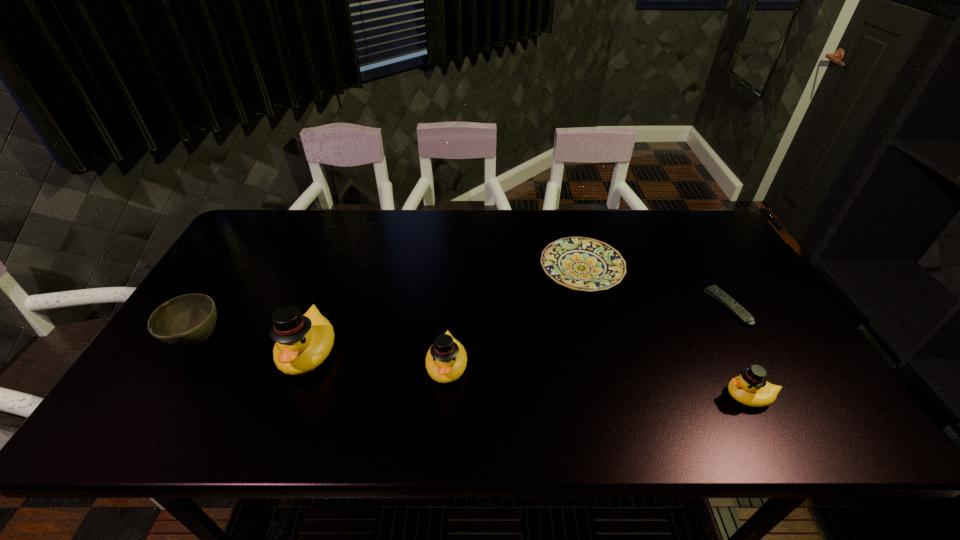
Locate an element on the screen. Image resolution: width=960 pixels, height=540 pixels. blank space at the far edge is located at coordinates (328, 229).

Image resolution: width=960 pixels, height=540 pixels. In the image, there is a desktop. Find the location of `vacant area at the near edge`. vacant area at the near edge is located at coordinates (540, 393).

You are a GUI agent. You are given a task and a screenshot of the screen. Output one action in this format:
    pyautogui.click(x=<x>, y=<y>)
    Task: Click on the free spot at the left edge of the desktop
    
    Given the screenshot: What is the action you would take?
    pyautogui.click(x=237, y=274)

This screenshot has width=960, height=540. In order to click on vacant space at the right edge of the desktop in this screenshot , I will do `click(772, 325)`.

In the image, there is a desktop. At what (x,y) coordinates should I click in order to perform the action: click on vacant space at the far left corner. Please return your answer as a coordinate pair (x, y). Looking at the image, I should click on (257, 210).

Image resolution: width=960 pixels, height=540 pixels. What are the coordinates of `free location at the near left corner of the desktop` in the screenshot? It's located at (211, 379).

Locate an element on the screen. Image resolution: width=960 pixels, height=540 pixels. vacant position at the far right corner of the desktop is located at coordinates (671, 215).

At what (x,y) coordinates should I click in order to perform the action: click on free space between the second tallest object and the plate. Please return your answer as a coordinate pair (x, y). The width and height of the screenshot is (960, 540). Looking at the image, I should click on (515, 317).

Where is `vacant area that lies between the shortest duck and the fifth object from right to left`? This screenshot has height=540, width=960. vacant area that lies between the shortest duck and the fifth object from right to left is located at coordinates (529, 374).

Locate an element on the screen. blank region between the fourth object from right to left and the shortest duck is located at coordinates (598, 381).